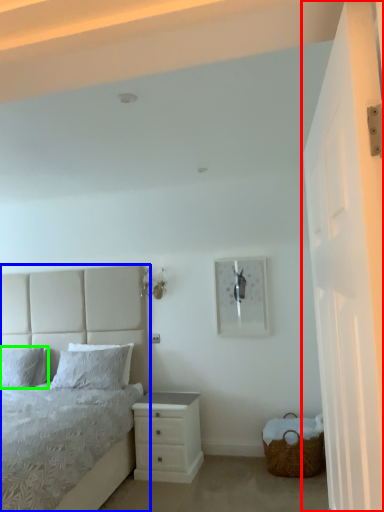
Question: Considering the real-world distances, which object is closest to glass door (highlighted by a red box)? bed (highlighted by a blue box) or pillow (highlighted by a green box).

Choices:
 (A) bed
 (B) pillow

Answer: (A)